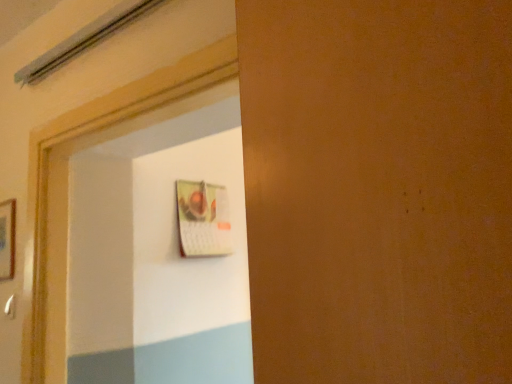
Question: From a real-world perspective, is white plastic door handle at lower left on wooden picture frame at left?

Choices:
 (A) yes
 (B) no

Answer: (B)

Question: Could you tell me if white plastic door handle at lower left is facing wooden picture frame at left?

Choices:
 (A) no
 (B) yes

Answer: (A)

Question: From the image's perspective, does white plastic door handle at lower left appear lower than wooden picture frame at left?

Choices:
 (A) yes
 (B) no

Answer: (A)

Question: Is wooden picture frame at left inside white plastic door handle at lower left?

Choices:
 (A) yes
 (B) no

Answer: (B)

Question: Is white plastic door handle at lower left thinner than wooden picture frame at left?

Choices:
 (A) yes
 (B) no

Answer: (A)

Question: Can you confirm if white plastic door handle at lower left is positioned to the right of wooden picture frame at left?

Choices:
 (A) no
 (B) yes

Answer: (B)

Question: Is wooden picture frame at left touching white plastic door handle at lower left?

Choices:
 (A) yes
 (B) no

Answer: (B)

Question: Is wooden picture frame at left at the right side of white plastic door handle at lower left?

Choices:
 (A) yes
 (B) no

Answer: (B)

Question: Does wooden picture frame at left contain white plastic door handle at lower left?

Choices:
 (A) no
 (B) yes

Answer: (A)

Question: Does wooden picture frame at left have a lesser height compared to white plastic door handle at lower left?

Choices:
 (A) no
 (B) yes

Answer: (A)

Question: Can you confirm if wooden picture frame at left is bigger than white plastic door handle at lower left?

Choices:
 (A) no
 (B) yes

Answer: (B)

Question: From a real-world perspective, is wooden picture frame at left located beneath white plastic door handle at lower left?

Choices:
 (A) yes
 (B) no

Answer: (B)

Question: Is white plastic door handle at lower left bigger or smaller than wooden picture frame at left?

Choices:
 (A) small
 (B) big

Answer: (A)